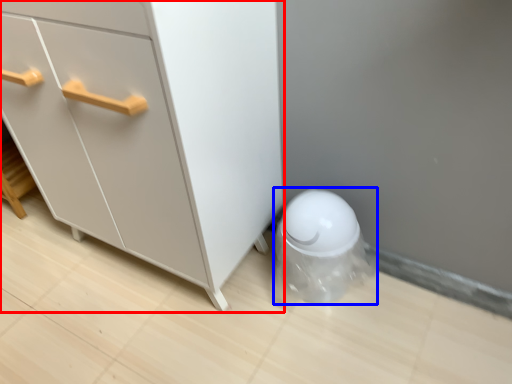
Question: Which object appears closest to the camera in this image, chest of drawers (highlighted by a red box) or porcelain (highlighted by a blue box)?

Choices:
 (A) chest of drawers
 (B) porcelain

Answer: (A)